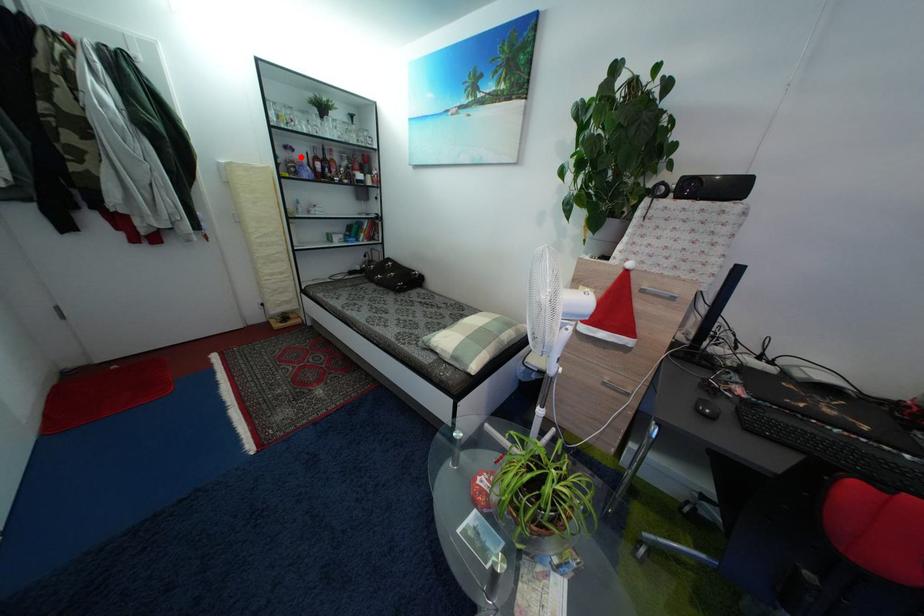
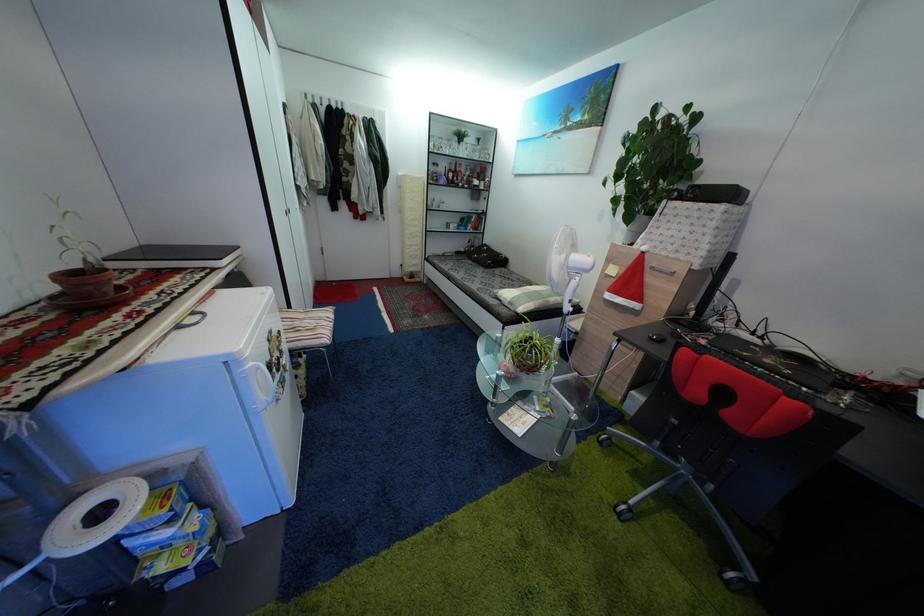
Question: A red point is marked in image1. In image2, is the corresponding 3D point closer to the camera or farther? Reply with the corresponding letter.

Choices:
 (A) The corresponding 3D point is closer.
 (B) The corresponding 3D point is farther.

Answer: (A)